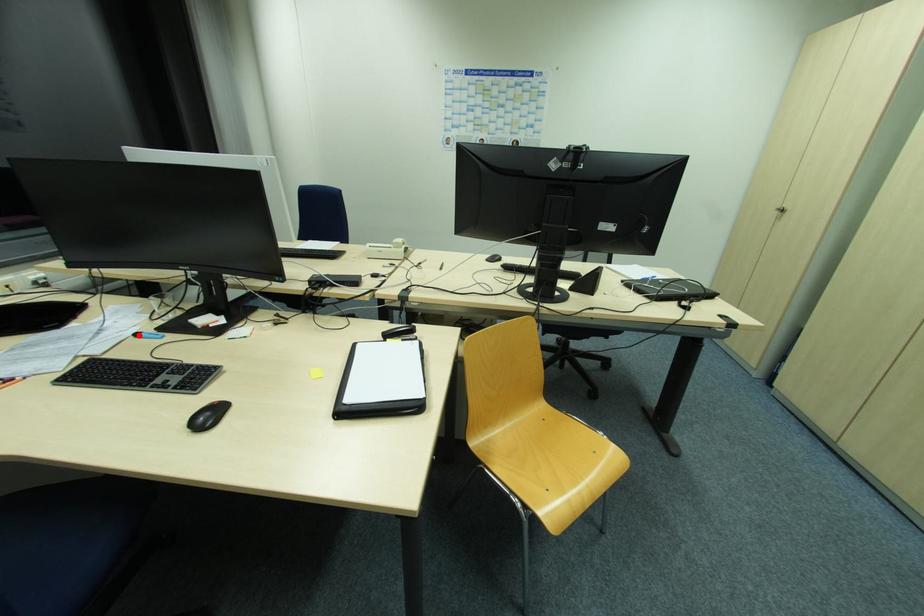
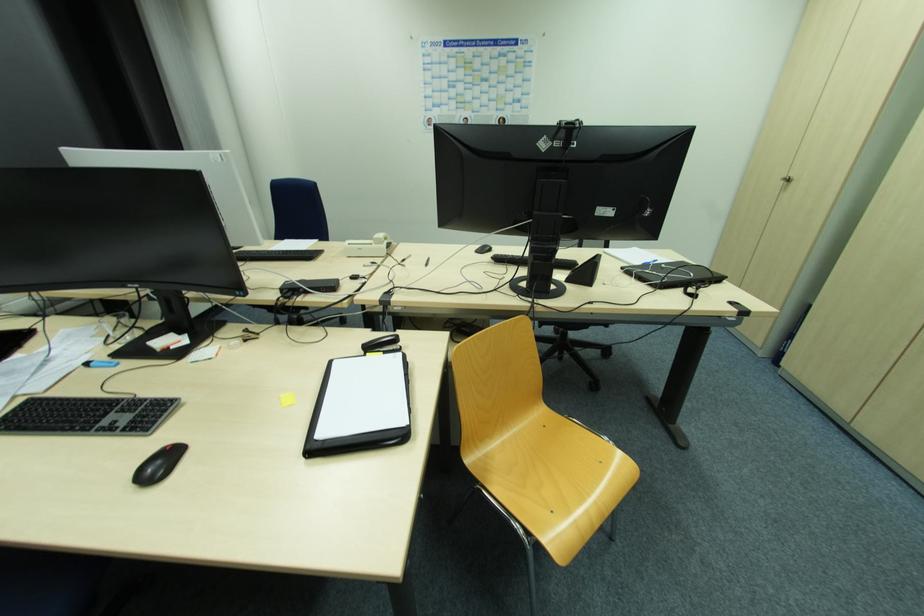
Question: I am providing you with two images of the same scene from different viewpoints. A red point is marked on the first image. Can you still see the location of the red point in image 2?

Choices:
 (A) Yes
 (B) No

Answer: (A)